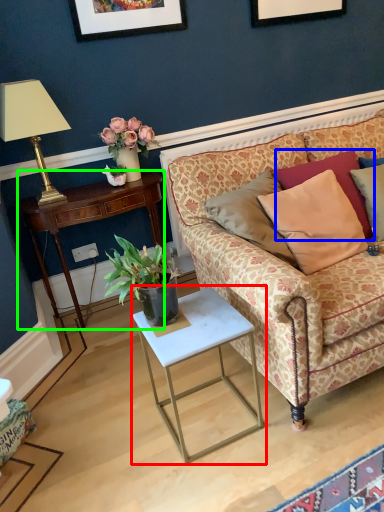
Question: Which object is the closest to the table (highlighted by a red box)? Choose among these: pillow (highlighted by a blue box) or desk (highlighted by a green box).

Choices:
 (A) pillow
 (B) desk

Answer: (A)